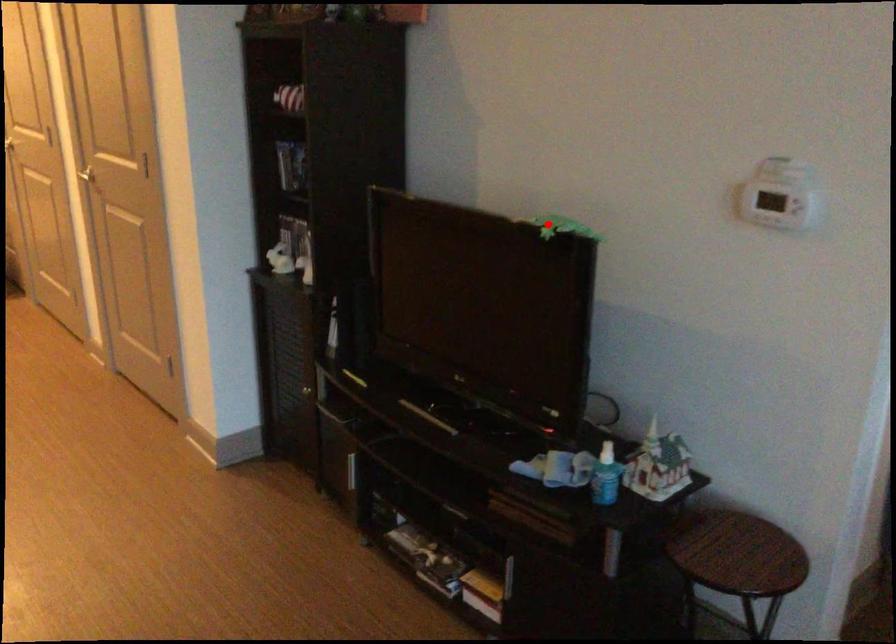
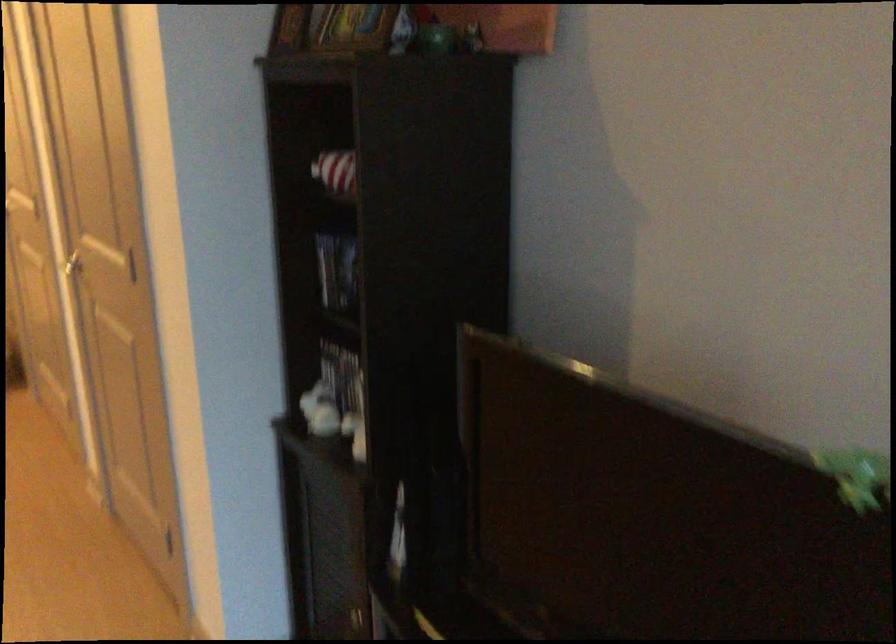
Question: I am providing you with two images of the same scene from different viewpoints. In image1, a red point is highlighted. Considering the same 3D point in image2, which of the following is correct?

Choices:
 (A) It is closer
 (B) It is farther

Answer: (A)